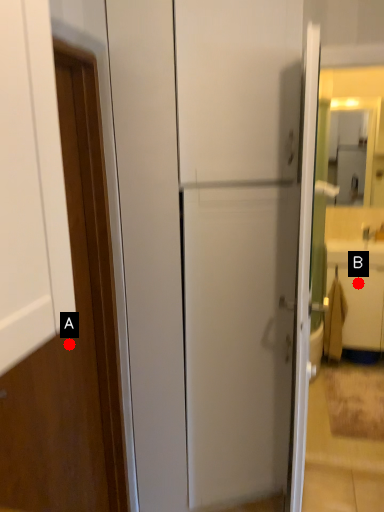
Question: Two points are circled on the image, labeled by A and B beside each circle. Which of the following is the closest to the observer?

Choices:
 (A) A is closer
 (B) B is closer

Answer: (A)